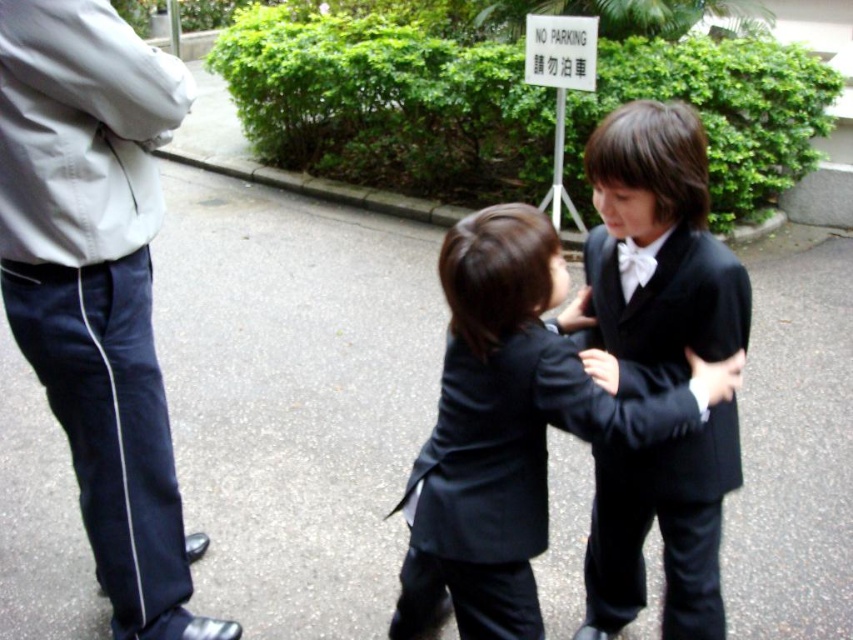
You are a tailor measuring the matte black suit at center and the white satin bowtie at center for alterations. Which item requires a longer vertical measurement for adjustments?

The matte black suit at center requires a longer vertical measurement since it is taller than the white satin bowtie at center.

You are a photographer taking a picture of the matte black suit at center and the white cotton jacket at upper left. Which object should you focus on first to ensure both are in sharp focus?

The white cotton jacket at upper left is further to the viewer than the matte black suit at center. To ensure both are in sharp focus, you should focus on the white cotton jacket at upper left first, as it is closer and focusing on the closer object first allows the depth of field to cover the farther object.

You are a photographer taking a group photo of the children. You need to ensure that the white cotton jacket at upper left and the matte black suit at center are both clearly visible. Which object should you focus on first to ensure proper exposure, considering their sizes?

The white cotton jacket at upper left has a smaller size compared to matte black suit at center. Therefore, you should focus on the matte black suit at center first since it is larger and will require more attention to capture details properly.